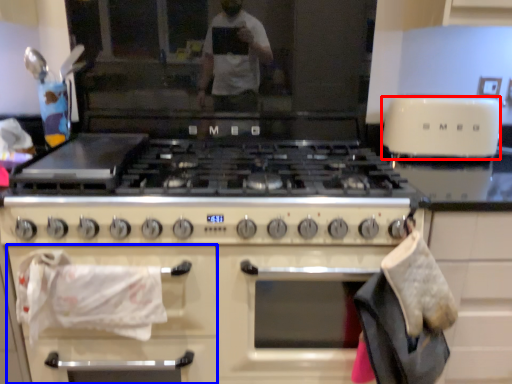
Question: Among these objects, which one is farthest to the camera, toaster (highlighted by a red box) or cabinetry (highlighted by a blue box)?

Choices:
 (A) toaster
 (B) cabinetry

Answer: (A)